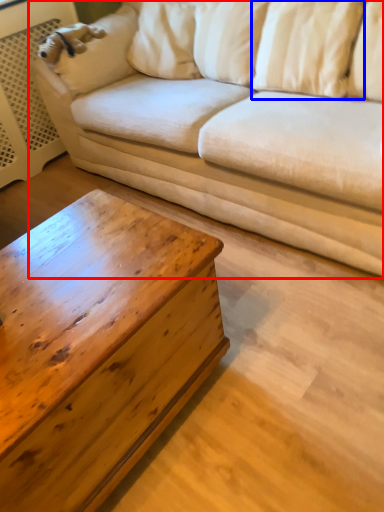
Question: Which object is further to the camera taking this photo, studio couch (highlighted by a red box) or pillow (highlighted by a blue box)?

Choices:
 (A) studio couch
 (B) pillow

Answer: (B)